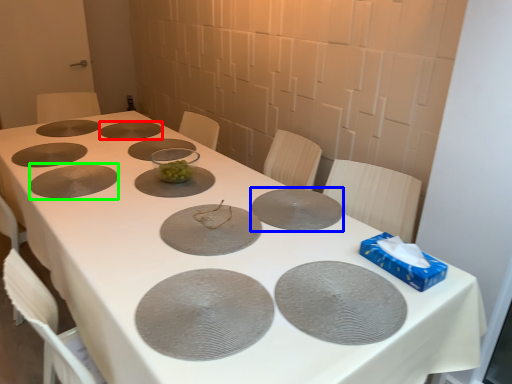
Question: Which is nearer to the glass plate (highlighted by a red box)? glass plate (highlighted by a blue box) or glass plate (highlighted by a green box).

Choices:
 (A) glass plate
 (B) glass plate

Answer: (B)